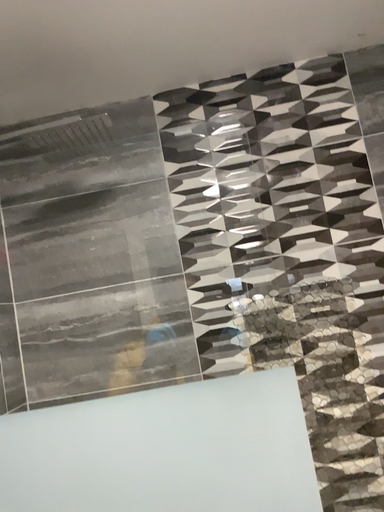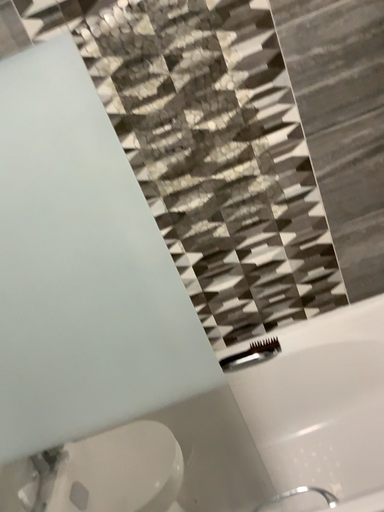
Question: Which way did the camera rotate in the video?

Choices:
 (A) rotated downward
 (B) rotated upward

Answer: (A)